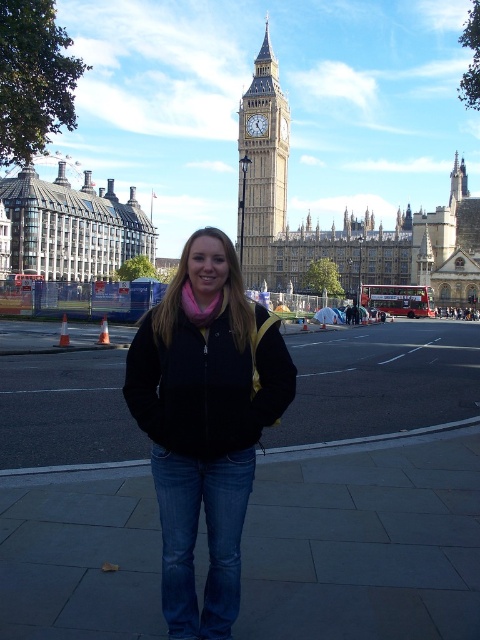
Based on the scene described, which object, the black fleece jacket at center or the stone building at left, is taller when viewed from the perspective of someone standing where the woman is positioned?

The black fleece jacket at center is taller than the stone building at left according to the description.

You are standing at point (x=31, y=177) and want to walk to the Big Ben clock tower in the background. Is point (x=164, y=589) located between you and the clock tower?

Yes, point (x=164, y=589) is located between you and the Big Ben clock tower because it is in front of point (x=31, y=177), which is your current position. Since you are moving towards the tower, the point ahead of your current location would be on your path towards the destination.

You are a photographer planning to capture a photo of the black fleece jacket at center and the stone building at left. Based on their sizes, which object should you focus on to ensure it fits entirely within the frame if the camera has limited zoom capabilities?

The stone building at left is wider than the black fleece jacket at center, so you should focus on capturing the stone building at left first to ensure it fits within the frame.